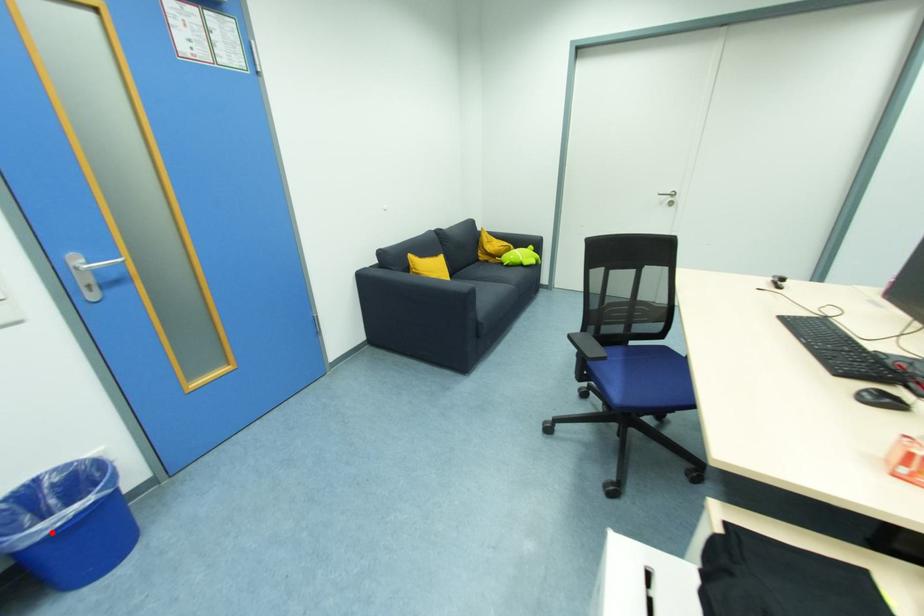
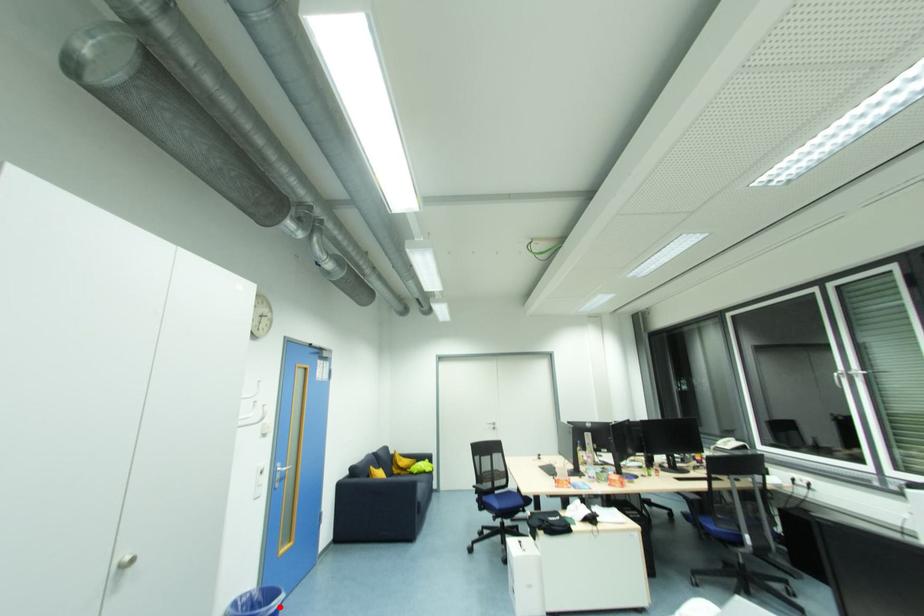
I am providing you with two images of the same scene from different viewpoints. A red point is marked on the first image and another point is marked on the second image. Is the marked point in image1 the same physical position as the marked point in image2?

Yes